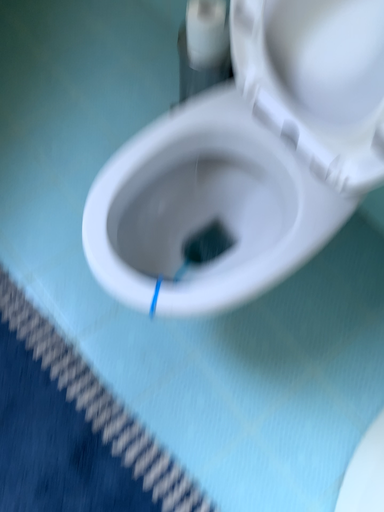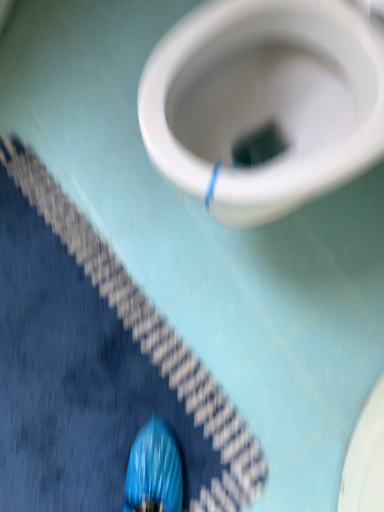
Question: Which way did the camera rotate in the video?

Choices:
 (A) rotated downward
 (B) rotated upward

Answer: (A)